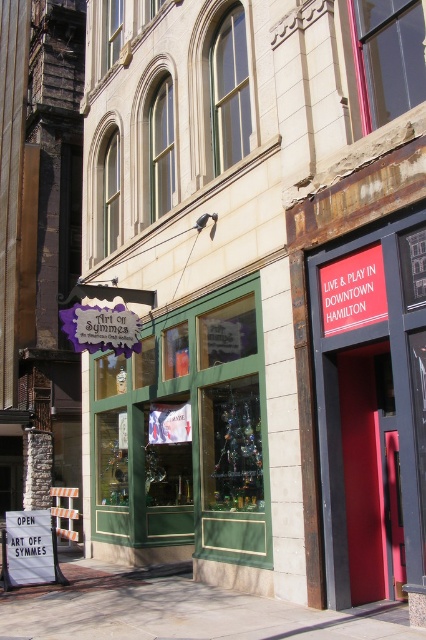
You are a GUI agent. You are given a task and a screenshot of the screen. Output one action in this format:
    pyautogui.click(x=<x>, y=<y>)
    Task: Click on the green glass window at center
    The height and width of the screenshot is (640, 426).
    Given the screenshot: What is the action you would take?
    pyautogui.click(x=186, y=435)

Can you confirm if green glass window at center is positioned to the right of white paper sign at lower left?

Indeed, green glass window at center is positioned on the right side of white paper sign at lower left.

Is point (244, 538) positioned in front of point (46, 528)?

Yes, point (244, 538) is closer to viewer.

Where is `green glass window at center`? Image resolution: width=426 pixels, height=640 pixels. green glass window at center is located at coordinates (186, 435).

Does red matte door at center come in front of white paper sign at lower left?

Yes, red matte door at center is closer to the viewer.

Who is taller, red matte door at center or white paper sign at lower left?

red matte door at center is taller.

Is point (363, 582) positioned after point (48, 545)?

No.

Where is `red matte door at center`? This screenshot has height=640, width=426. red matte door at center is located at coordinates (371, 410).

Which is below, green glass window at center or paved stone sidewalk at lower center?

paved stone sidewalk at lower center is lower down.

Does point (222, 387) come farther from viewer compared to point (414, 637)?

Yes, it is behind point (414, 637).

Which is in front, point (258, 518) or point (314, 612)?

Point (314, 612) is more forward.

Identify the location of green glass window at center. (186, 435).